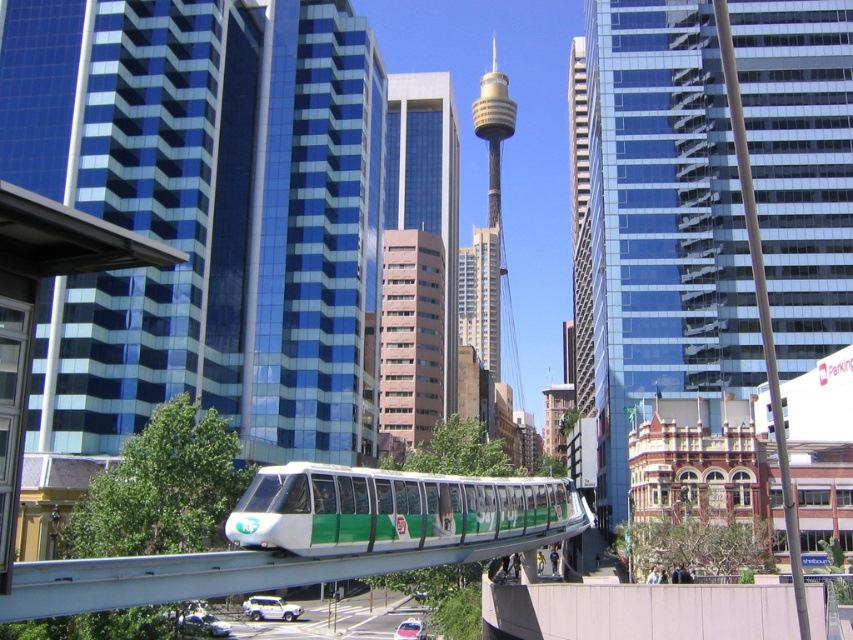
You are standing at the base of the pink glass tower at center and looking out towards the monorail train. In which direction relative to your position does the monorail train appear to be located?

The monorail train is located to the left side of the pink glass tower at center based on the coordinates provided.

You are a city planner evaluating the visual impact of the green matte monorail at center and the glassy blue skyscraper at center. Which structure appears larger in the scene?

The glassy blue skyscraper at center is bigger than the green matte monorail at center, so it appears larger in the scene.

You are a city planner reviewing the urban layout. You see the pink glass tower at center and the pink smooth building at center. Which one is positioned higher in the city skyline?

The pink glass tower at center is located above the pink smooth building at center, so it is positioned higher in the skyline.